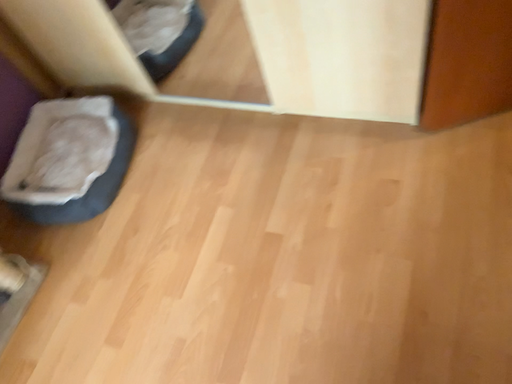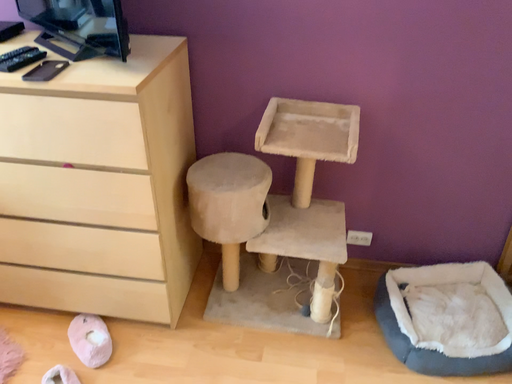
Question: How did the camera likely rotate when shooting the video?

Choices:
 (A) rotated upward
 (B) rotated downward

Answer: (A)